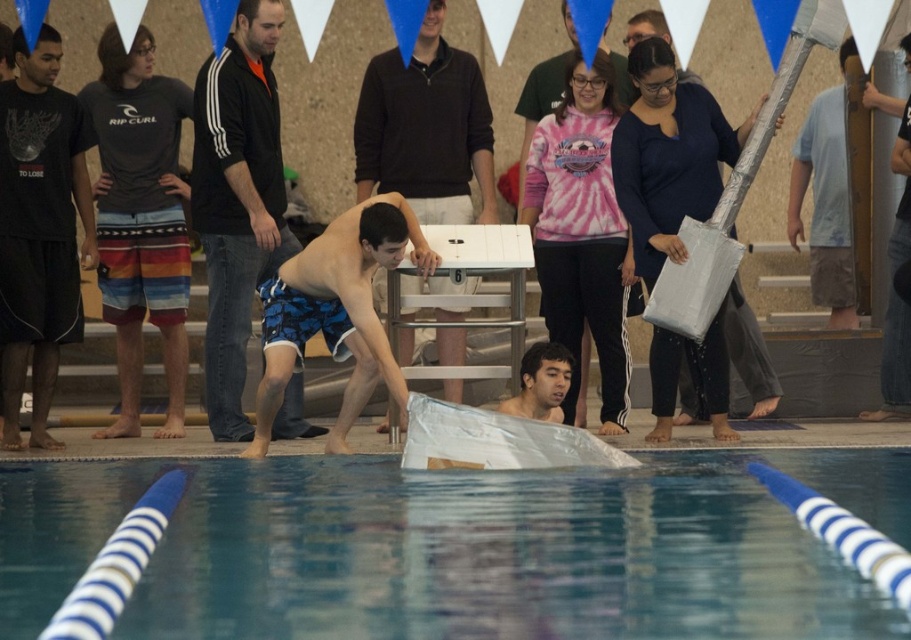
Question: Observing the image, what is the correct spatial positioning of blue printed shorts at center in reference to silver reflective guitar at center?

Choices:
 (A) left
 (B) right

Answer: (A)

Question: Estimate the real-world distances between objects in this image. Which object is farther from the transparent plastic water at center?

Choices:
 (A) smooth skin boy at center
 (B) pink tie-dye shirt at center
 (C) black cotton t-shirt at left

Answer: (B)

Question: Is silver reflective guitar at center behind pink tie-dye shirt at center?

Choices:
 (A) yes
 (B) no

Answer: (B)

Question: Does black cotton t-shirt at left appear on the left side of blue camouflage shorts at center?

Choices:
 (A) no
 (B) yes

Answer: (B)

Question: Which point appears farthest from the camera in this image?

Choices:
 (A) (241, 301)
 (B) (548, 61)

Answer: (B)

Question: Which point is closer to the camera taking this photo?

Choices:
 (A) (568, 497)
 (B) (58, 342)

Answer: (A)